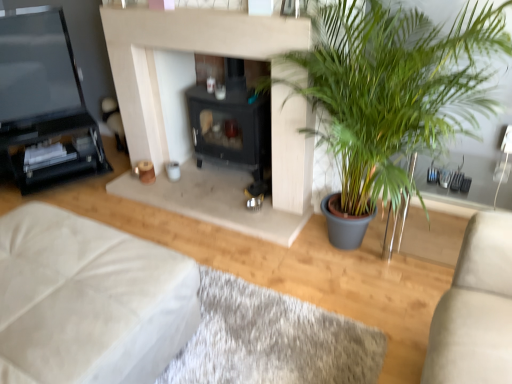
Question: Is black matte fireplace at center oriented towards white fabric ottoman at lower left?

Choices:
 (A) no
 (B) yes

Answer: (B)

Question: Can you confirm if black matte fireplace at center is bigger than white fabric ottoman at lower left?

Choices:
 (A) no
 (B) yes

Answer: (A)

Question: Would you say white fabric ottoman at lower left is part of black matte fireplace at center's contents?

Choices:
 (A) yes
 (B) no

Answer: (B)

Question: Is black matte fireplace at center at the right side of white fabric ottoman at lower left?

Choices:
 (A) no
 (B) yes

Answer: (B)

Question: From the image's perspective, is black matte fireplace at center located above white fabric ottoman at lower left?

Choices:
 (A) yes
 (B) no

Answer: (A)

Question: Is point (272, 311) positioned closer to the camera than point (33, 64)?

Choices:
 (A) farther
 (B) closer

Answer: (B)

Question: Based on their positions, is white fabric at lower left located to the left or right of matte black tv at left?

Choices:
 (A) right
 (B) left

Answer: (A)

Question: From a real-world perspective, relative to matte black tv at left, is white fabric at lower left vertically above or below?

Choices:
 (A) above
 (B) below

Answer: (B)

Question: Is white fabric at lower left wider or thinner than matte black tv at left?

Choices:
 (A) thin
 (B) wide

Answer: (B)

Question: Is matte black tv at left taller or shorter than white fabric at lower left?

Choices:
 (A) tall
 (B) short

Answer: (A)

Question: From the image's perspective, is matte black tv at left located above or below white fabric at lower left?

Choices:
 (A) below
 (B) above

Answer: (B)

Question: Is matte black tv at left wider or thinner than white fabric at lower left?

Choices:
 (A) thin
 (B) wide

Answer: (A)

Question: Considering their positions, is matte black tv at left located in front of or behind white fabric at lower left?

Choices:
 (A) front
 (B) behind

Answer: (B)

Question: Considering the positions of point (61, 43) and point (373, 77), is point (61, 43) closer or farther from the camera than point (373, 77)?

Choices:
 (A) farther
 (B) closer

Answer: (A)

Question: In the image, is matte black tv at left on the left side or the right side of green leafy plant at right?

Choices:
 (A) right
 (B) left

Answer: (B)